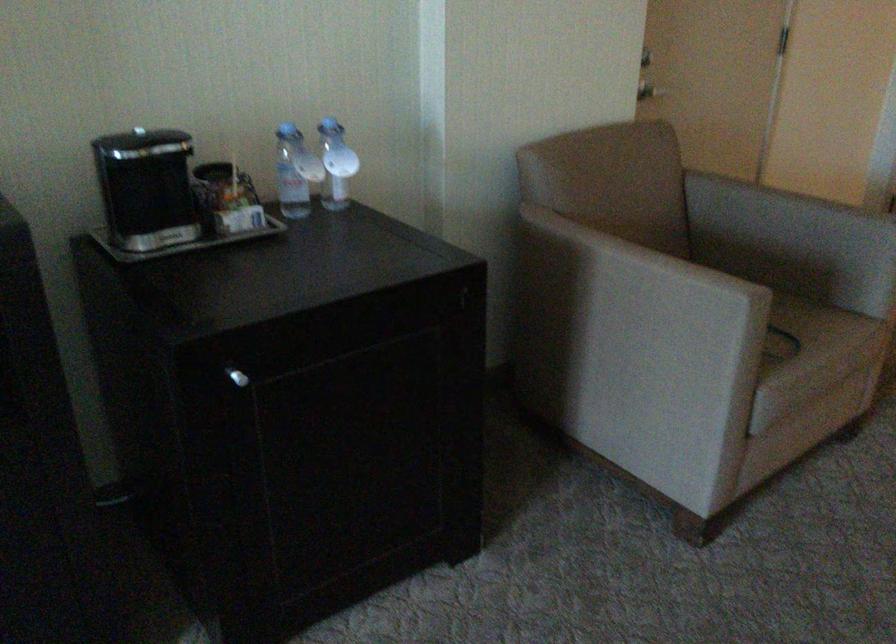
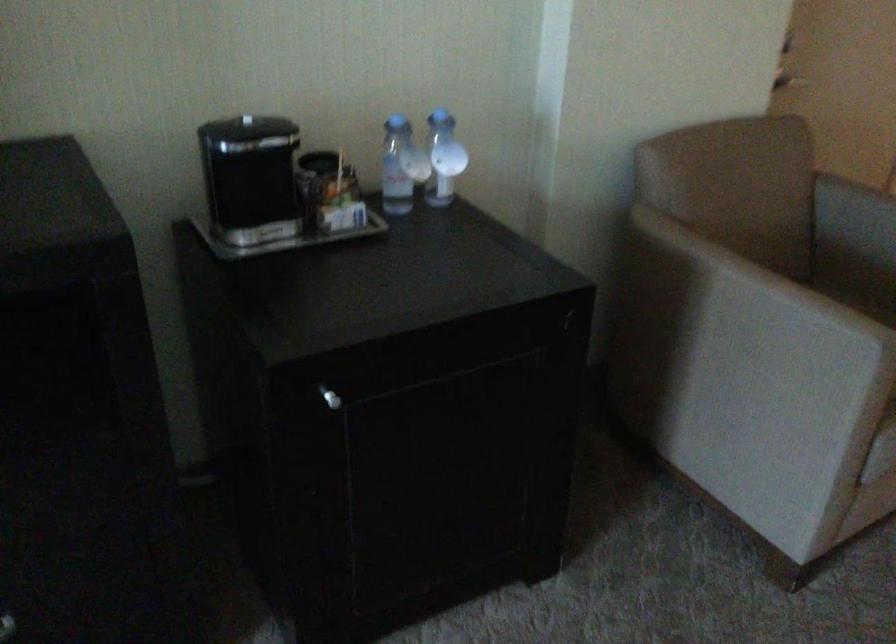
The point at (138, 129) is marked in the first image. Where is the corresponding point in the second image?

(246, 120)